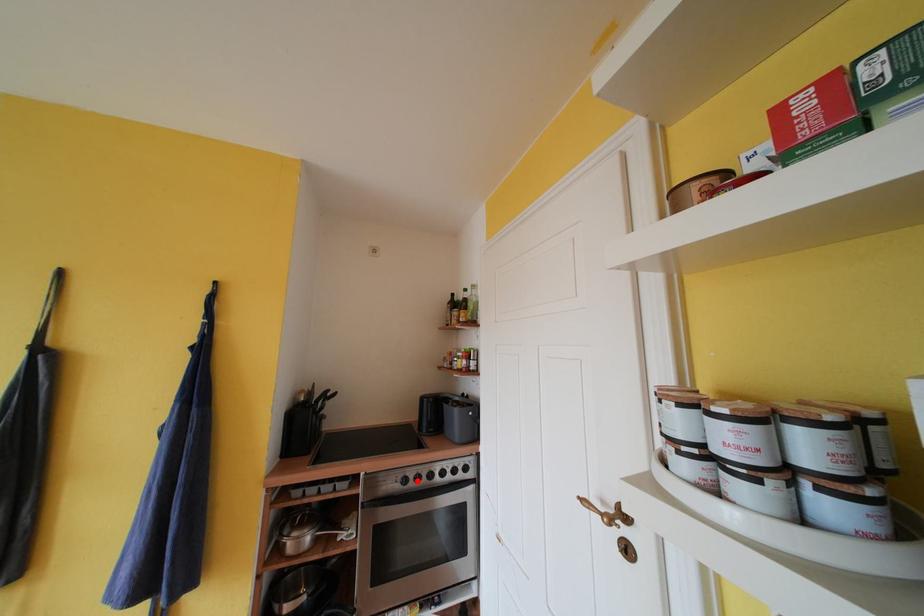
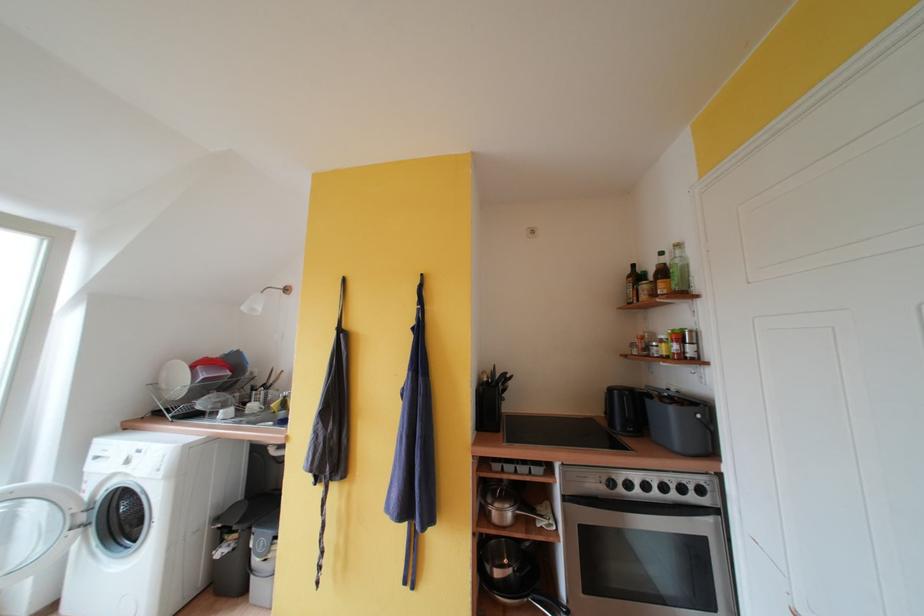
Locate, in the second image, the point that corresponds to the highlighted location in the first image.

(626, 485)